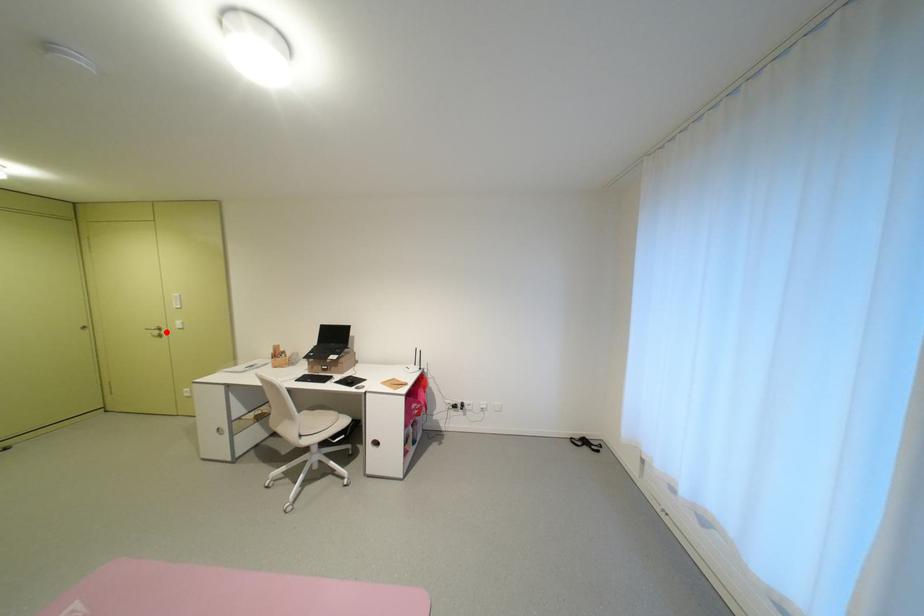
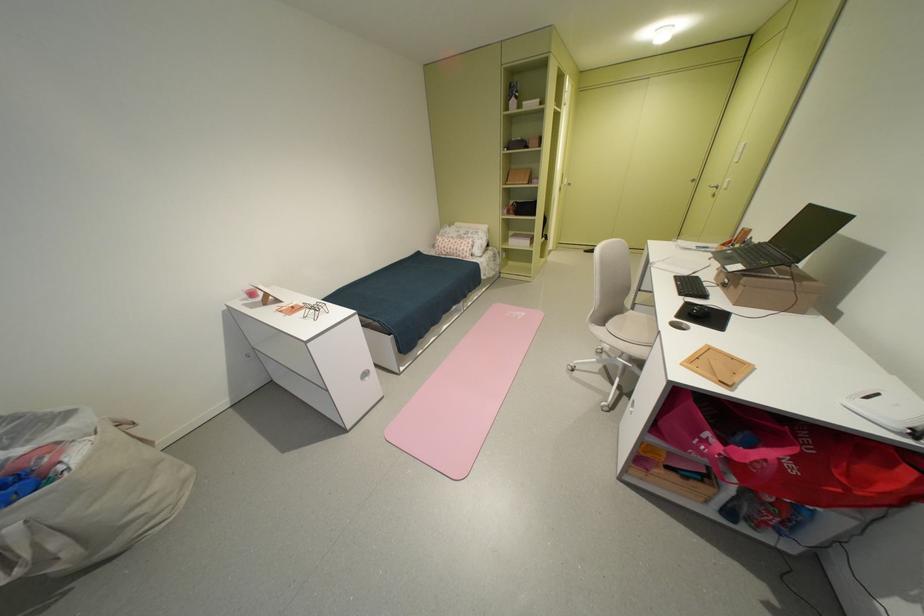
In the second image, find the point that corresponds to the highlighted location in the first image.

(724, 190)